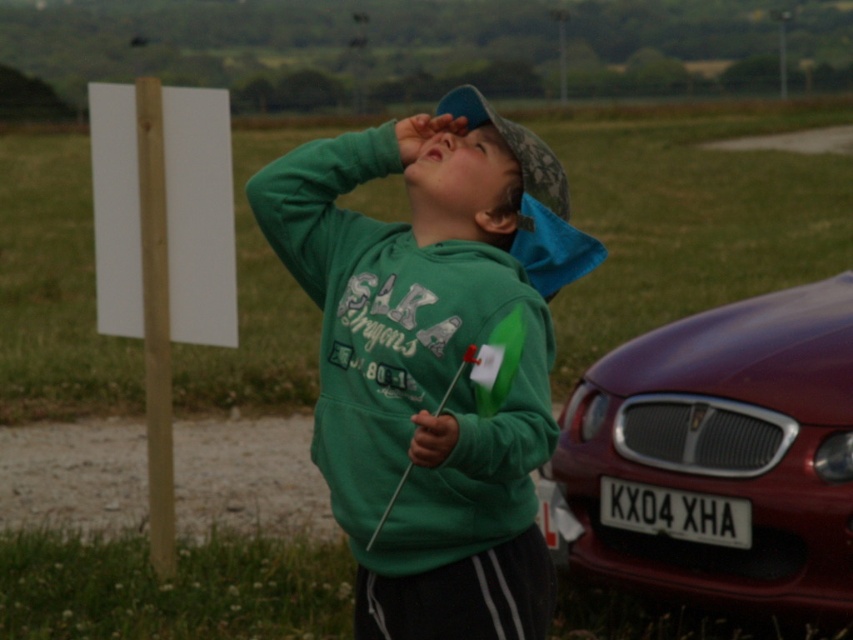
Can you confirm if green matte sweatshirt at center is wider than shiny maroon car at lower right?

In fact, green matte sweatshirt at center might be narrower than shiny maroon car at lower right.

Who is positioned more to the left, green matte sweatshirt at center or shiny maroon car at lower right?

Positioned to the left is green matte sweatshirt at center.

Which is behind, point (456, 417) or point (780, 445)?

The point (780, 445) is behind.

Where is `green matte sweatshirt at center`? The height and width of the screenshot is (640, 853). green matte sweatshirt at center is located at coordinates (431, 360).

What do you see at coordinates (674, 513) in the screenshot? I see `white plastic license plate at lower right` at bounding box center [674, 513].

Who is positioned more to the left, white plastic license plate at lower right or green cotton hoodie at center?

green cotton hoodie at center is more to the left.

Who is more forward, (608, 493) or (526, 221)?

Point (526, 221)

Locate an element on the screen. The width and height of the screenshot is (853, 640). white plastic license plate at lower right is located at coordinates (674, 513).

Does white plastic license plate at lower right appear under blue glossy eye at upper center?

Yes.

Does white plastic license plate at lower right appear on the left side of blue glossy eye at upper center?

In fact, white plastic license plate at lower right is to the right of blue glossy eye at upper center.

Between point (682, 490) and point (474, 140), which one is positioned in front?

Point (474, 140)

The image size is (853, 640). I want to click on white plastic license plate at lower right, so click(674, 513).